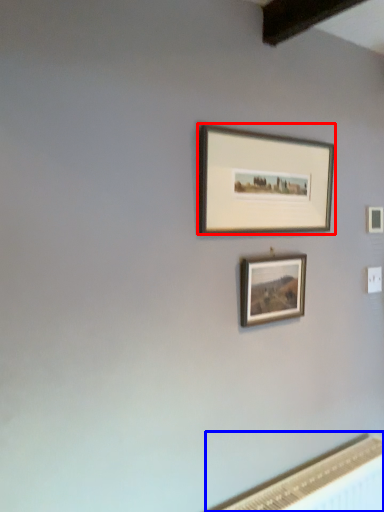
Question: Which object is further to the camera taking this photo, picture frame (highlighted by a red box) or radiator (highlighted by a blue box)?

Choices:
 (A) picture frame
 (B) radiator

Answer: (A)